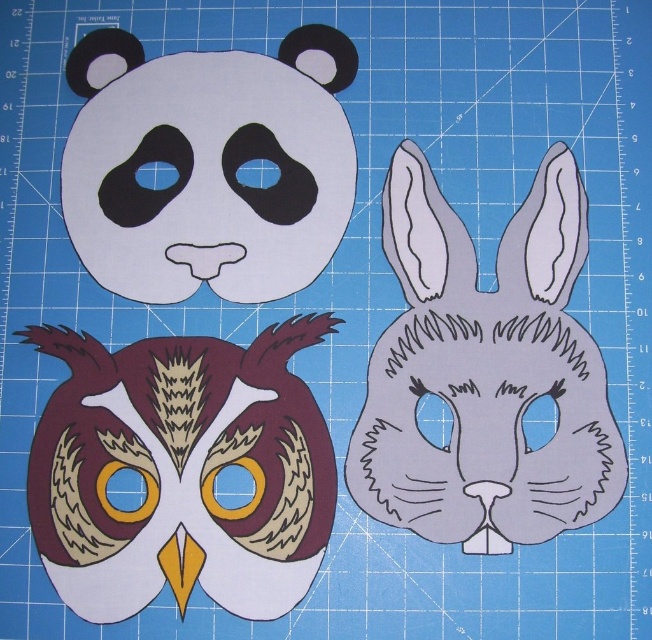
In the scene shown: You are a child trying to decide which owl mask to wear for a play. The matte brown owl mask at center and the matte brown paper owl at upper left are both available. Which one would you choose if you want a taller mask?

The matte brown owl mask at center is much taller than the matte brown paper owl at upper left, so you should choose the matte brown owl mask at center.

You are a child trying to organize your craft supplies. You have two owl masks on your blue cutting mat. One is labeled as the matte brown owl at center and the other as the matte brown owl mask at center. You need to place them in order from top to bottom. Which one should you place on top?

You should place the matte brown owl at center on top because it is located above the matte brown owl mask at center according to the description.